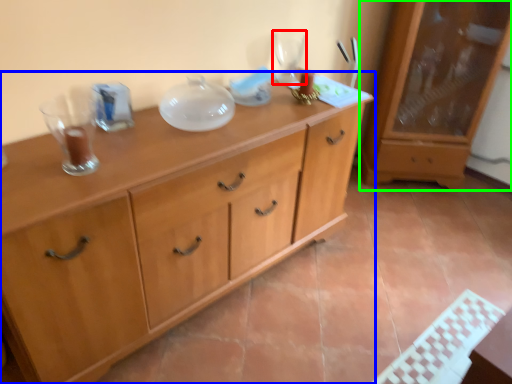
Question: Estimate the real-world distances between objects in this image. Which object is closer to wine glass (highlighted by a red box), chest of drawers (highlighted by a blue box) or cabinetry (highlighted by a green box)?

Choices:
 (A) chest of drawers
 (B) cabinetry

Answer: (A)